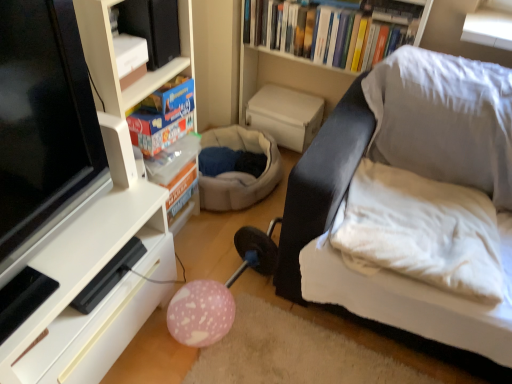
Measure the distance between point (115, 310) and camera.

They are 1.23 meters apart.

The image size is (512, 384). I want to click on hardcover books at upper center, marked as the 1th book in a right-to-left arrangement, so click(335, 30).

What is the approximate width of pink matte balloon at lower center?

The width of pink matte balloon at lower center is 8.01 inches.

Where is `white matte shelf at left, the 1th shelf when ordered from top to bottom`? The height and width of the screenshot is (384, 512). white matte shelf at left, the 1th shelf when ordered from top to bottom is located at coordinates (70, 201).

The width and height of the screenshot is (512, 384). Find the location of `the 1st shelf behind when counting from the black glossy tv at left`. the 1st shelf behind when counting from the black glossy tv at left is located at coordinates (87, 290).

From their relative heights in the image, would you say white glossy shelf at lower left, the first shelf in the bottom-to-top sequence, is taller or shorter than black glossy tv at left?

In the image, white glossy shelf at lower left, the first shelf in the bottom-to-top sequence, appears to be shorter than black glossy tv at left.

Considering the points (168, 235) and (75, 110), which point is behind, point (168, 235) or point (75, 110)?

Positioned behind is point (168, 235).

Is white glossy shelf at lower left, acting as the 2th shelf starting from the top, next to black glossy tv at left?

There is a gap between white glossy shelf at lower left, acting as the 2th shelf starting from the top, and black glossy tv at left.

At what (x,y) coordinates should I click in order to perform the action: click on window screen in front of the black leather couch at right. Please return your answer as a coordinate pair (x, y). Looking at the image, I should click on (44, 129).

Which is behind, point (105, 154) or point (441, 330)?

The point (441, 330) is behind.

Would you say black glossy tv at left is outside black leather couch at right?

Yes, black glossy tv at left is located beyond the bounds of black leather couch at right.

How different are the orientations of black glossy tv at left and black leather couch at right in degrees?

The angular difference between black glossy tv at left and black leather couch at right is 89.7 degrees.

How different are the orientations of white matte shelf at left, placed as the second shelf when sorted from bottom to top, and hardcover books at upper center, the second book in the front-to-back sequence, in degrees?

The angle between the facing direction of white matte shelf at left, placed as the second shelf when sorted from bottom to top, and the facing direction of hardcover books at upper center, the second book in the front-to-back sequence, is 92.2 degrees.

Which of these two, white matte shelf at left, the 1th shelf when ordered from top to bottom, or hardcover books at upper center, which ranks as the second book in bottom-to-top order, is thinner?

hardcover books at upper center, which ranks as the second book in bottom-to-top order.

Does point (84, 68) lie in front of point (244, 42)?

Yes, point (84, 68) is closer to viewer.

Is white matte shelf at left, placed as the second shelf when sorted from bottom to top, located outside hardcover books at upper center, the 1th book from the top?

Absolutely, white matte shelf at left, placed as the second shelf when sorted from bottom to top, is external to hardcover books at upper center, the 1th book from the top.

Considering the relative sizes of white soft pillow at right and white matte shelf at left, the 1th shelf when ordered from top to bottom, in the image provided, is white soft pillow at right bigger than white matte shelf at left, the 1th shelf when ordered from top to bottom,?

No, white soft pillow at right is not bigger than white matte shelf at left, the 1th shelf when ordered from top to bottom.

Can you confirm if white soft pillow at right is thinner than white matte shelf at left, placed as the second shelf when sorted from bottom to top?

No, white soft pillow at right is not thinner than white matte shelf at left, placed as the second shelf when sorted from bottom to top.

Could you tell me if white soft pillow at right is turned towards white matte shelf at left, the 1th shelf when ordered from top to bottom?

No.

Based on their positions, is white soft pillow at right located to the left or right of white matte shelf at left, placed as the second shelf when sorted from bottom to top?

Clearly, white soft pillow at right is on the right of white matte shelf at left, placed as the second shelf when sorted from bottom to top, in the image.

Which of these two, white soft pillow at right or white glossy shelf at lower left, acting as the 2th shelf starting from the top, is bigger?

white glossy shelf at lower left, acting as the 2th shelf starting from the top.

In the image, is white soft pillow at right positioned in front of or behind white glossy shelf at lower left, the first shelf in the bottom-to-top sequence?

In the image, white soft pillow at right appears behind white glossy shelf at lower left, the first shelf in the bottom-to-top sequence.

Can you see white soft pillow at right touching white glossy shelf at lower left, acting as the 2th shelf starting from the top?

white soft pillow at right is not next to white glossy shelf at lower left, acting as the 2th shelf starting from the top, and they're not touching.

Considering the sizes of objects white soft pillow at right and white glossy shelf at lower left, acting as the 2th shelf starting from the top, in the image provided, who is thinner, white soft pillow at right or white glossy shelf at lower left, acting as the 2th shelf starting from the top,?

With smaller width is white glossy shelf at lower left, acting as the 2th shelf starting from the top.

Considering the sizes of objects pink matte balloon at lower center and white textured bookshelf at upper center in the image provided, who is thinner, pink matte balloon at lower center or white textured bookshelf at upper center?

pink matte balloon at lower center.

Would you consider pink matte balloon at lower center to be distant from white textured bookshelf at upper center?

Indeed, pink matte balloon at lower center is not near white textured bookshelf at upper center.

Identify the location of balloon located on the left of white textured bookshelf at upper center. (200, 313).

In the image, is pink matte balloon at lower center positioned in front of or behind white textured bookshelf at upper center?

Clearly, pink matte balloon at lower center is in front of white textured bookshelf at upper center.

Is hardcover books at upper center, which ranks as the second book in bottom-to-top order, directly adjacent to white matte shelf at left, placed as the second shelf when sorted from bottom to top?

hardcover books at upper center, which ranks as the second book in bottom-to-top order, is not next to white matte shelf at left, placed as the second shelf when sorted from bottom to top, and they're not touching.

Is white matte shelf at left, the 1th shelf when ordered from top to bottom, located within hardcover books at upper center, marked as the 1th book in a right-to-left arrangement?

Actually, white matte shelf at left, the 1th shelf when ordered from top to bottom, is outside hardcover books at upper center, marked as the 1th book in a right-to-left arrangement.

From a real-world perspective, between hardcover books at upper center, the second book from the left, and white matte shelf at left, placed as the second shelf when sorted from bottom to top, who is vertically lower?

white matte shelf at left, placed as the second shelf when sorted from bottom to top, from a real-world perspective.

Is hardcover books at upper center, the second book in the front-to-back sequence, thinner than white matte shelf at left, the 1th shelf when ordered from top to bottom?

Yes.

In the image, there is a white glossy shelf at lower left, acting as the 2th shelf starting from the top. At what (x,y) coordinates should I click in order to perform the action: click on window screen above it (from the image's perspective). Please return your answer as a coordinate pair (x, y). This screenshot has width=512, height=384. Looking at the image, I should click on (44, 129).

Identify the location of studio couch that is under the black glossy tv at left (from a real-world perspective). (395, 143).

From the image, which object appears to be nearer to black glossy tv at left, black leather couch at right or white textured bookshelf at upper center?

Among the two, black leather couch at right is located nearer to black glossy tv at left.

Looking at the image, which one is located further to black leather couch at right, pink matte balloon at lower center or black glossy tv at left?

The object further to black leather couch at right is black glossy tv at left.

Based on their spatial positions, is black glossy tv at left or white glossy shelf at lower left, the first shelf in the bottom-to-top sequence, closer to white matte shelf at left, the 1th shelf when ordered from top to bottom?

white glossy shelf at lower left, the first shelf in the bottom-to-top sequence, is positioned closer to the anchor white matte shelf at left, the 1th shelf when ordered from top to bottom.

Looking at this image, considering their positions, is blue cardboard box at upper left, the first book in the left-to-right sequence, positioned closer to black leather couch at right than white glossy shelf at lower left, the first shelf in the bottom-to-top sequence?

white glossy shelf at lower left, the first shelf in the bottom-to-top sequence, is closer to black leather couch at right.

From the image, which object appears to be farther from white glossy shelf at lower left, acting as the 2th shelf starting from the top, white soft pillow at right or blue cardboard box at upper left, which ranks as the 1th book in bottom-to-top order?

white soft pillow at right is positioned further to the anchor white glossy shelf at lower left, acting as the 2th shelf starting from the top.

Estimate the real-world distances between objects in this image. Which object is closer to pink matte balloon at lower center, blue cardboard box at upper left, the first book in the left-to-right sequence, or hardcover books at upper center, which is the first book in back-to-front order?

Among the two, blue cardboard box at upper left, the first book in the left-to-right sequence, is located nearer to pink matte balloon at lower center.

Looking at the image, which one is located closer to pink matte balloon at lower center, hardcover books at upper center, the second book in the front-to-back sequence, or black leather couch at right?

Among the two, black leather couch at right is located nearer to pink matte balloon at lower center.

Based on their spatial positions, is black leather couch at right or black glossy tv at left further from pink matte balloon at lower center?

black glossy tv at left is further to pink matte balloon at lower center.

Find the location of `pillow between black leather couch at right and white textured bookshelf at upper center along the z-axis`. pillow between black leather couch at right and white textured bookshelf at upper center along the z-axis is located at coordinates (422, 230).

Locate an element on the screen. The image size is (512, 384). studio couch located between black glossy tv at left and hardcover books at upper center, the second book from the left, in the depth direction is located at coordinates (395, 143).

Where is `window screen situated between white glossy shelf at lower left, acting as the 2th shelf starting from the top, and black leather couch at right from left to right`? This screenshot has width=512, height=384. window screen situated between white glossy shelf at lower left, acting as the 2th shelf starting from the top, and black leather couch at right from left to right is located at coordinates (44, 129).

This screenshot has width=512, height=384. I want to click on pillow between blue cardboard box at upper left, the 2th book from the back, and black leather couch at right, so click(x=422, y=230).